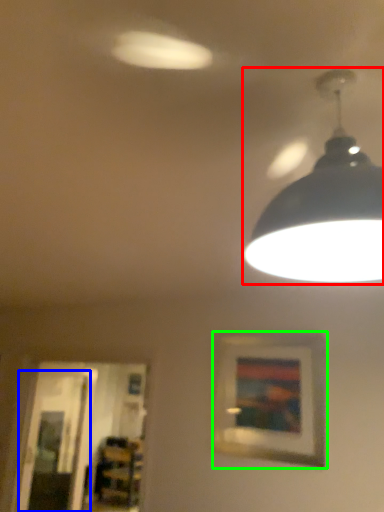
Question: Based on their relative distances, which object is farther from lamp (highlighted by a red box)? Choose from glass door (highlighted by a blue box) and picture frame (highlighted by a green box).

Choices:
 (A) glass door
 (B) picture frame

Answer: (A)